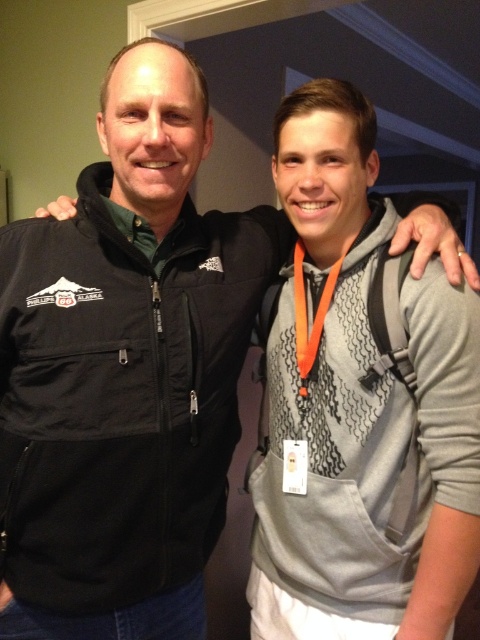
Describe the element at coordinates (307, 314) in the screenshot. I see `orange fabric lanyard at center` at that location.

I want to click on orange fabric lanyard at center, so click(x=307, y=314).

Where is `orange fabric lanyard at center`? This screenshot has height=640, width=480. orange fabric lanyard at center is located at coordinates (307, 314).

Does black softshell jacket at center lie behind green fabric at center?

That is False.

Who is shorter, black softshell jacket at center or green fabric at center?

Standing shorter between the two is green fabric at center.

Where is `black softshell jacket at center`? black softshell jacket at center is located at coordinates (121, 396).

Find the location of a particular element. This screenshot has height=640, width=480. black softshell jacket at center is located at coordinates (121, 396).

Consider the image. Is black softshell jacket at center bigger than orange fabric lanyard at center?

Indeed, black softshell jacket at center has a larger size compared to orange fabric lanyard at center.

Is point (22, 307) positioned before point (307, 332)?

That is True.

Identify the location of black softshell jacket at center. This screenshot has width=480, height=640. (121, 396).